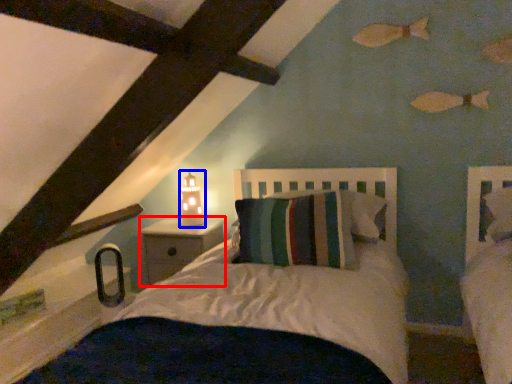
Question: Which object is further to the camera taking this photo, nightstand (highlighted by a red box) or table lamp (highlighted by a blue box)?

Choices:
 (A) nightstand
 (B) table lamp

Answer: (B)